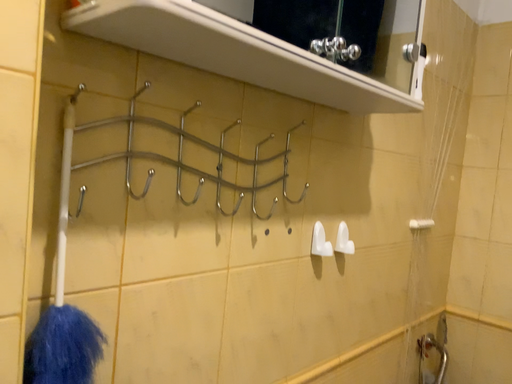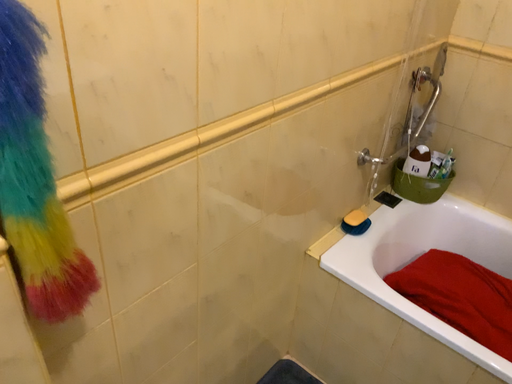
Question: How did the camera likely rotate when shooting the video?

Choices:
 (A) rotated upward
 (B) rotated downward

Answer: (B)